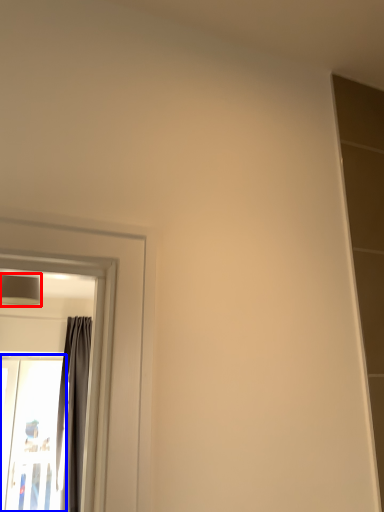
Question: Among these objects, which one is farthest to the camera, lamp (highlighted by a red box) or screen door (highlighted by a blue box)?

Choices:
 (A) lamp
 (B) screen door

Answer: (B)